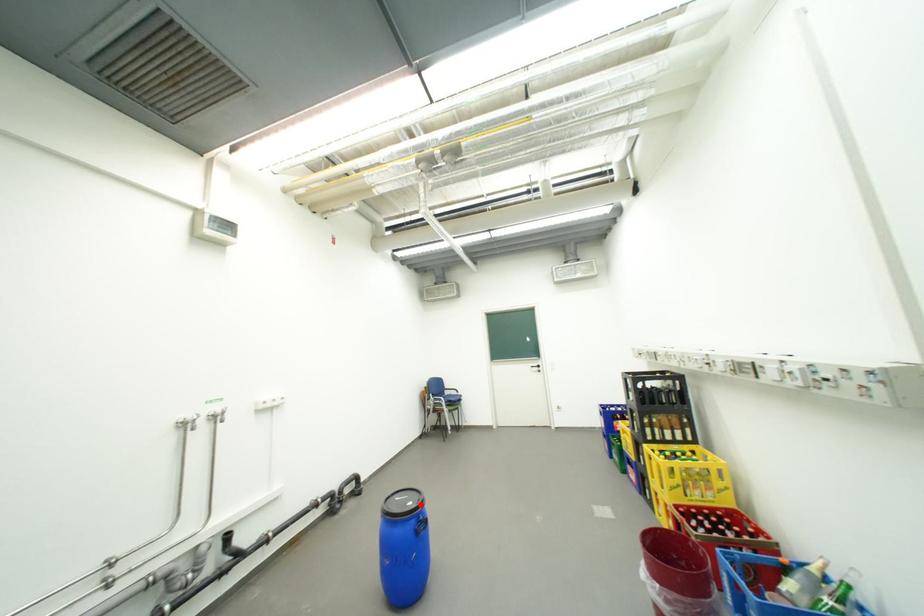
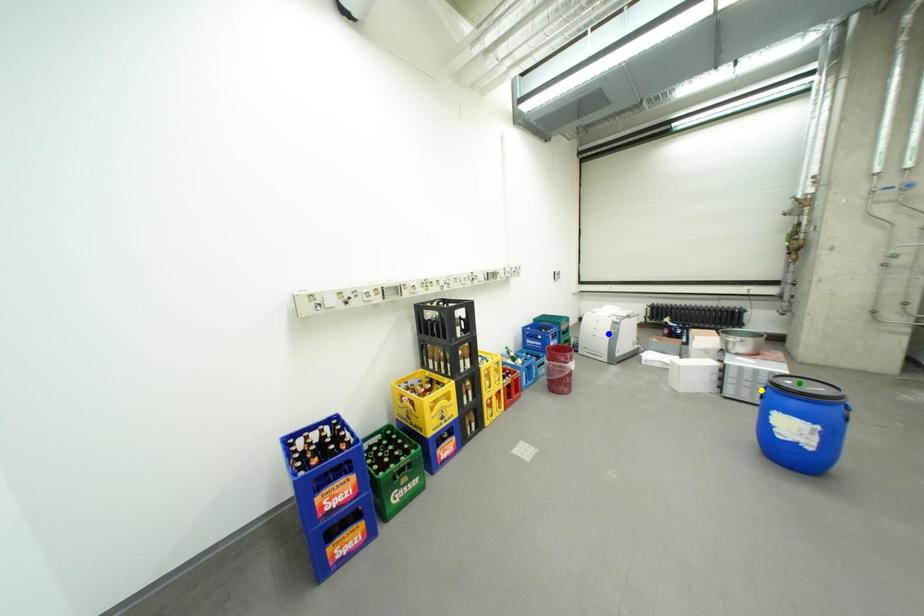
Question: I am providing you with two images of the same scene from different viewpoints. A red point is marked on the first image. You are given multiple points on the second image. Which point in image 2 is actually the same real-world point as the red point in image 1?

Choices:
 (A) blue point
 (B) green point
 (C) yellow point

Answer: (B)